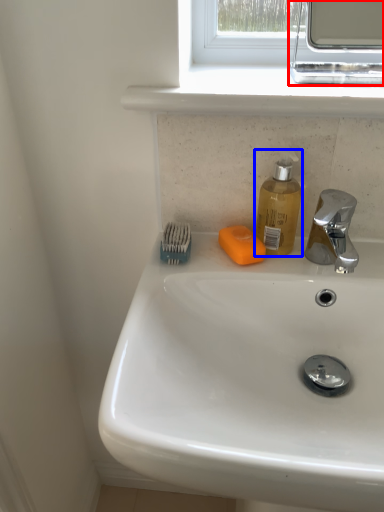
Question: Among these objects, which one is nearest to the camera, medicine cabinet (highlighted by a red box) or soap dispenser (highlighted by a blue box)?

Choices:
 (A) medicine cabinet
 (B) soap dispenser

Answer: (A)